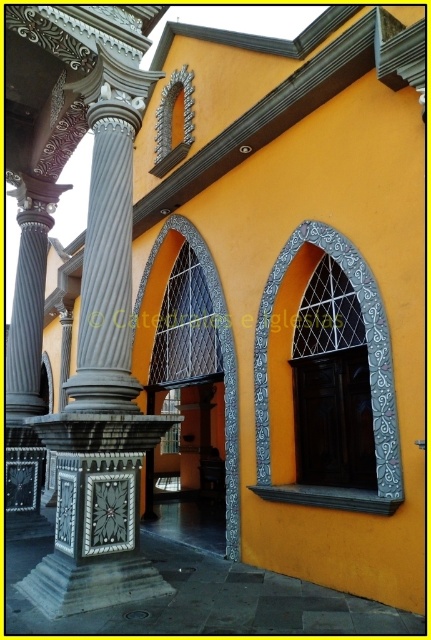
You are an architect designing a new building and want to incorporate elements from this image. You have a limited space and need to know which of the two elements, the silver textured frame at center or the silver metallic archway at center, takes up more horizontal space. Can you determine which one is wider?

The silver textured frame at center is wider than the silver metallic archway at center because the description states that the silver textured frame at center surpasses the silver metallic archway at center in width.

You are standing in front of the building and want to take a photo. You notice two points marked on the image. Which point is closer to your camera, point 1 at coordinates point (374, 406) or point 2 at coordinates point (227, 428)?

Point 1 at coordinates point (374, 406) is closer to the camera than point 2 at coordinates point (227, 428).